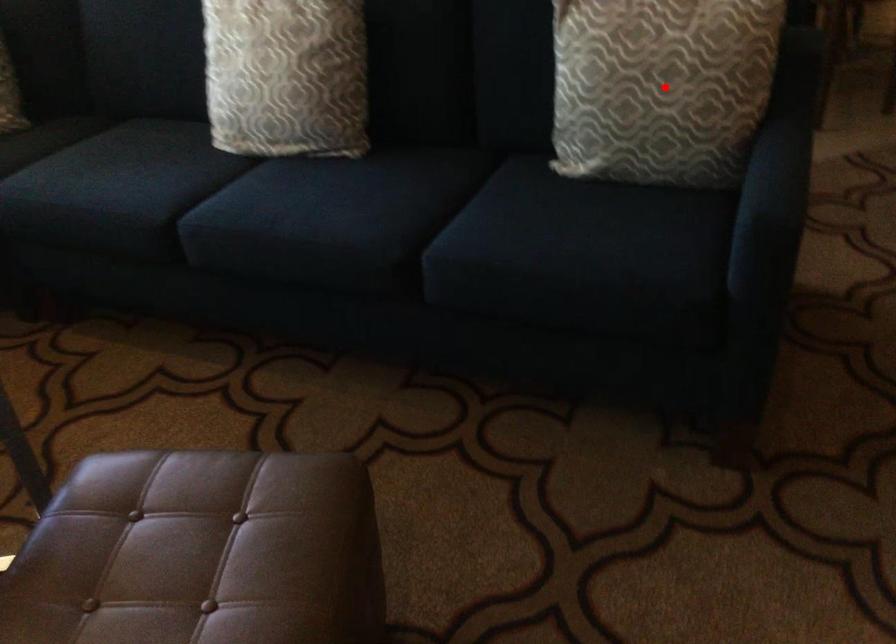
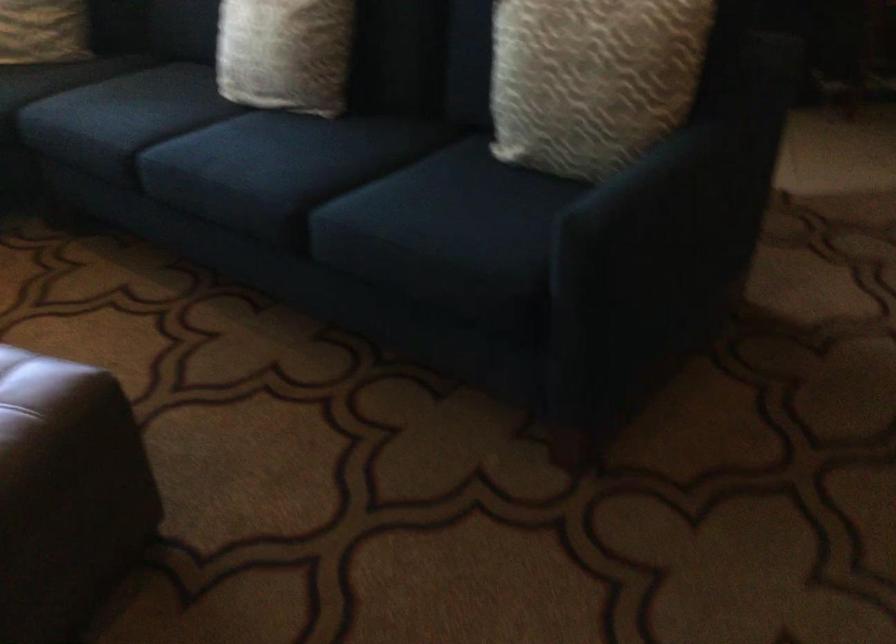
Find the pixel in the second image that matches the highlighted location in the first image.

(591, 80)